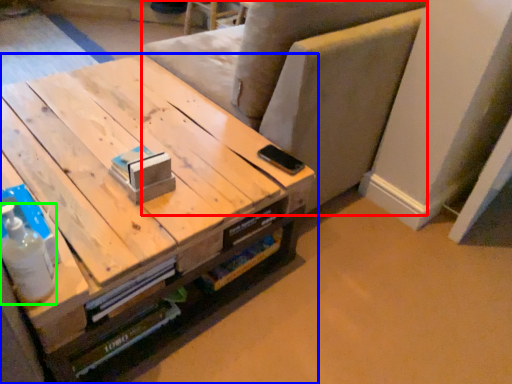
Question: Based on their relative distances, which object is nearer to armchair (highlighted by a red box)? Choose from table (highlighted by a blue box) and bottle (highlighted by a green box).

Choices:
 (A) table
 (B) bottle

Answer: (A)